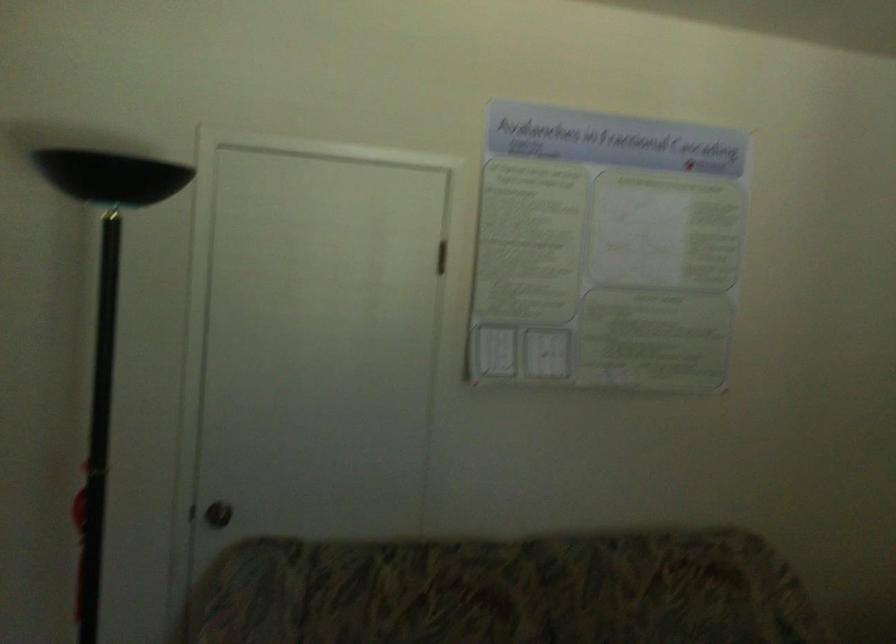
What do you see at coordinates (218, 514) in the screenshot? I see `the round door knob` at bounding box center [218, 514].